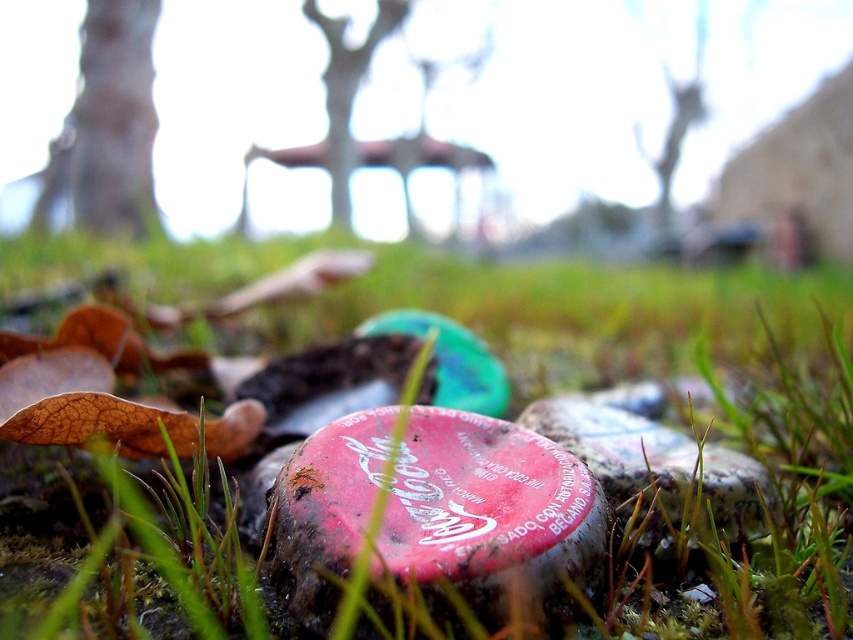
You are a gardener who wants to place a new decorative item between the rubberized red cap at center and the green matte tree at upper center. Based on their positions, where should you place the item to ensure it is between them?

The rubberized red cap at center is positioned on the left side of green matte tree at upper center, so you should place the new decorative item between them to the right of the rubberized red cap at center and to the left of the green matte tree at upper center.

You are standing at the center of the grassy area and see the point marked at coordinates [184,468]. What is the color of the ground at that point?

The point at [184,468] is on green grass at center, so the ground color there is green.

You are standing on the grassy ground and looking towards the smooth bark tree trunk at upper left and the green matte tree at upper center. Which tree is shorter?

The smooth bark tree trunk at upper left is shorter than the green matte tree at upper center.